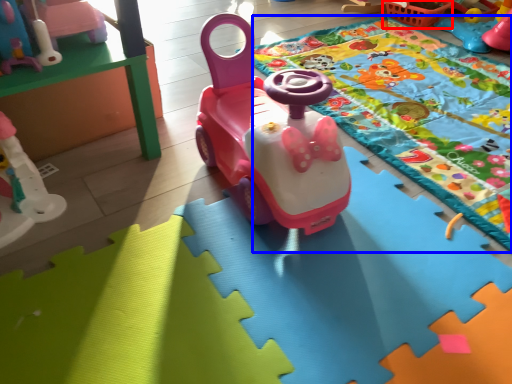
Question: Among these objects, which one is nearest to the camera, basket (highlighted by a red box) or blanket (highlighted by a blue box)?

Choices:
 (A) basket
 (B) blanket

Answer: (B)